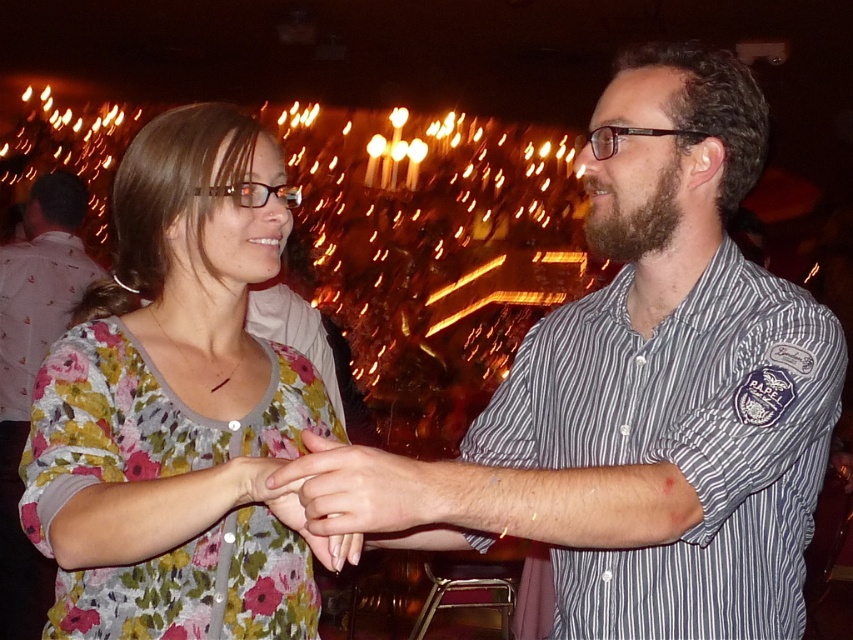
Question: Is floral print blouse at left further to camera compared to striped cotton shirt at right?

Choices:
 (A) yes
 (B) no

Answer: (B)

Question: Estimate the real-world distances between objects in this image. Which object is closer to the striped cotton shirt at center?

Choices:
 (A) floral print blouse at left
 (B) smooth skin hands at center
 (C) striped cotton shirt at right

Answer: (C)

Question: In this image, where is striped cotton shirt at center located relative to striped cotton shirt at right?

Choices:
 (A) left
 (B) right

Answer: (A)

Question: Is striped cotton shirt at center bigger than striped cotton shirt at right?

Choices:
 (A) no
 (B) yes

Answer: (B)

Question: Which point is farther to the camera?

Choices:
 (A) floral print blouse at left
 (B) striped cotton shirt at center
 (C) striped cotton shirt at right

Answer: (C)

Question: Based on their relative distances, which object is farther from the striped cotton shirt at center?

Choices:
 (A) striped cotton shirt at right
 (B) smooth skin hands at center

Answer: (B)